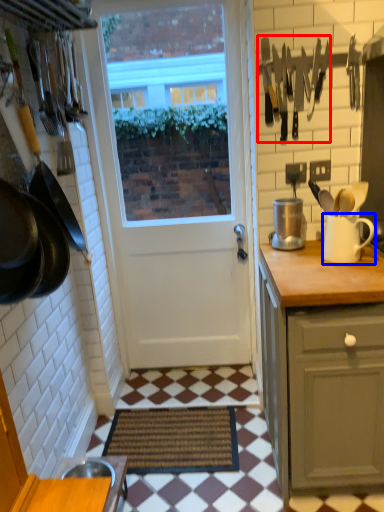
Question: Among these objects, which one is nearest to the camera, cutlery (highlighted by a red box) or jug (highlighted by a blue box)?

Choices:
 (A) cutlery
 (B) jug

Answer: (B)